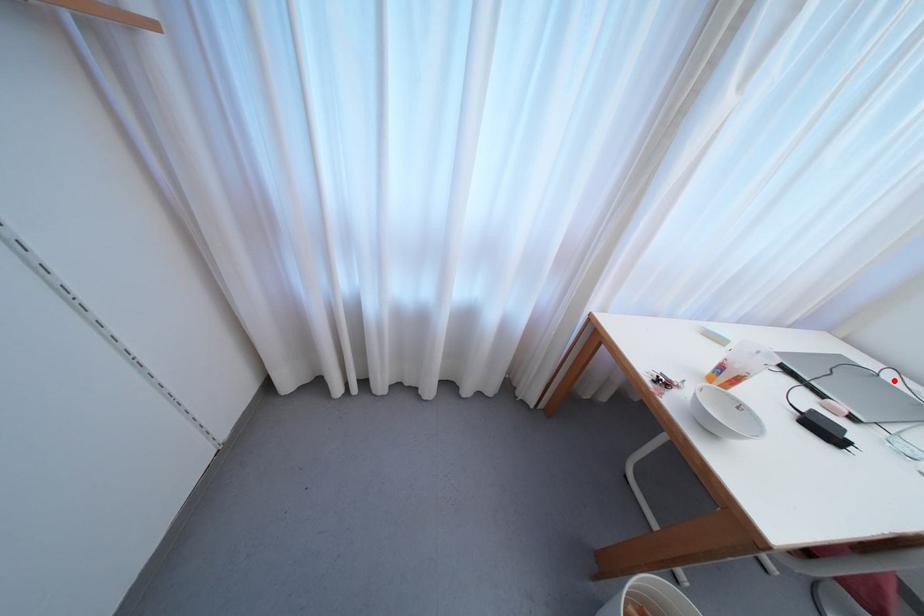
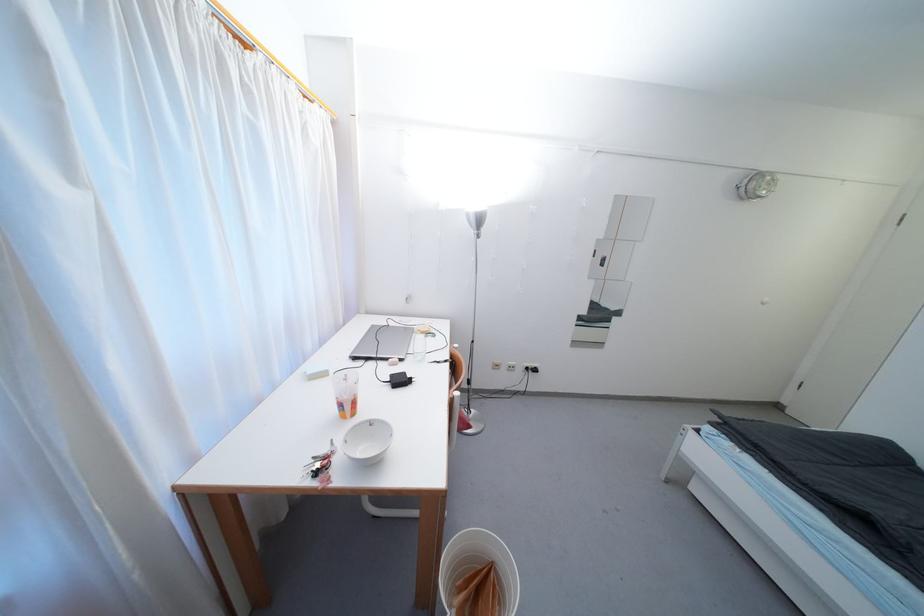
In the second image, find the point that corresponds to the highlighted location in the first image.

(395, 326)